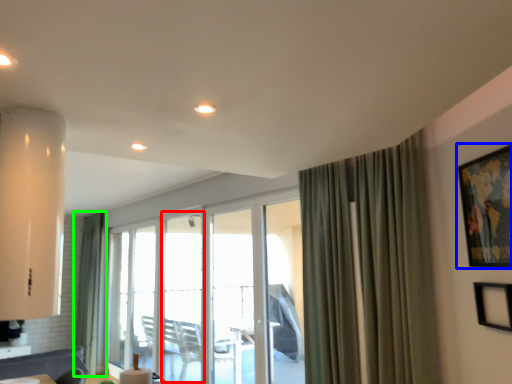
Question: Which object is positioned farthest from window (highlighted by a red box)? Select from picture frame (highlighted by a blue box) and curtain (highlighted by a green box).

Choices:
 (A) picture frame
 (B) curtain

Answer: (A)